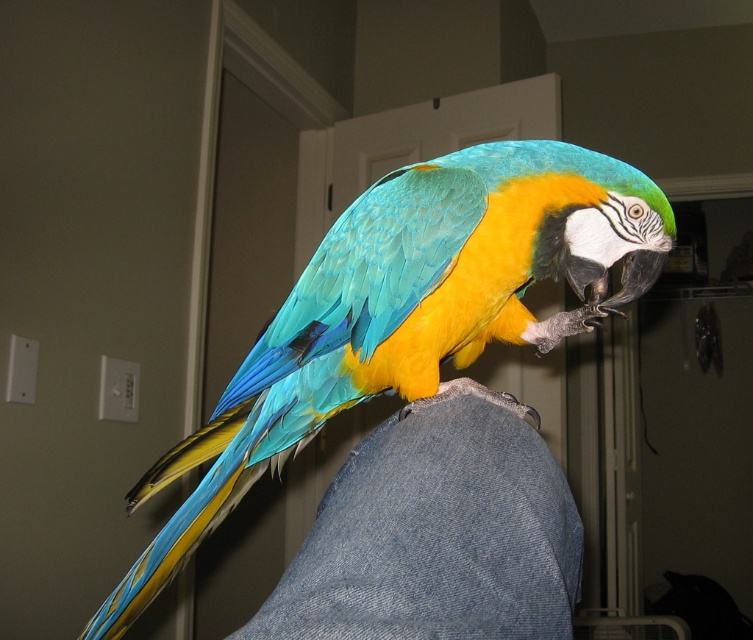
Question: Which point is farther to the camera?

Choices:
 (A) (334, 573)
 (B) (578, 330)

Answer: (B)

Question: Does shiny blue-green parrot at center have a larger size compared to faded denim jeans at center?

Choices:
 (A) yes
 (B) no

Answer: (A)

Question: Which of the following is the closest to the observer?

Choices:
 (A) shiny blue-green parrot at center
 (B) faded denim jeans at center

Answer: (B)

Question: Is shiny blue-green parrot at center below faded denim jeans at center?

Choices:
 (A) no
 (B) yes

Answer: (A)

Question: Does shiny blue-green parrot at center appear under faded denim jeans at center?

Choices:
 (A) no
 (B) yes

Answer: (A)

Question: Which point appears closest to the camera in this image?

Choices:
 (A) (473, 192)
 (B) (485, 481)

Answer: (B)